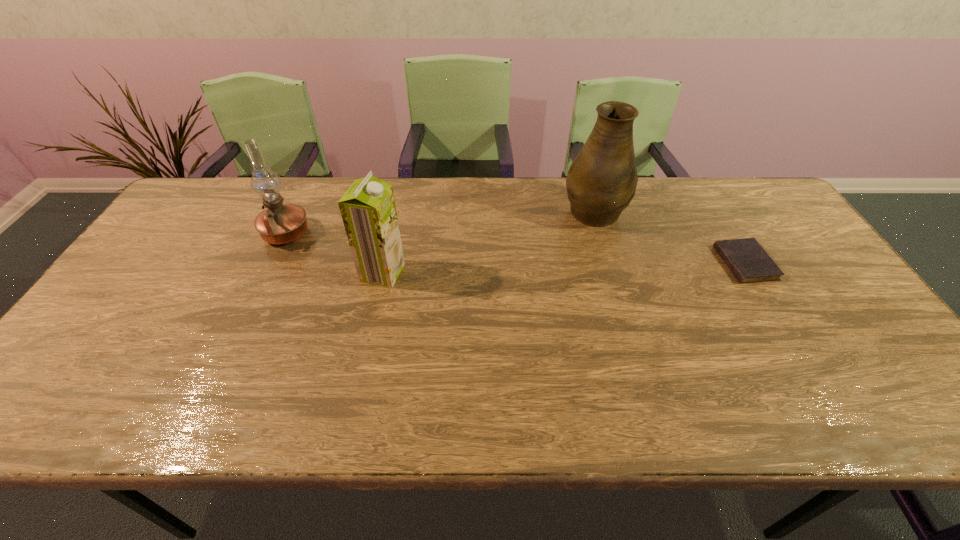
Identify the location of the second object from right to left. (601, 182).

At what (x,y) coordinates should I click in order to perform the action: click on the leftmost object. Please return your answer as a coordinate pair (x, y). Looking at the image, I should click on (279, 224).

Locate an element on the screen. The height and width of the screenshot is (540, 960). the third object from right to left is located at coordinates (368, 210).

Identify the location of the rightmost object. (748, 261).

Find the location of a particular element. The width and height of the screenshot is (960, 540). the shortest object is located at coordinates (748, 261).

Where is `vacant space situated on the handle side of the third object from left to right`? This screenshot has width=960, height=540. vacant space situated on the handle side of the third object from left to right is located at coordinates (585, 179).

At what (x,y) coordinates should I click in order to perform the action: click on free space located on the handle side of the third object from left to right. Please return your answer as a coordinate pair (x, y). This screenshot has width=960, height=540. Looking at the image, I should click on (585, 179).

This screenshot has width=960, height=540. Identify the location of free space located 0.240m on the right of the oil lamp. (391, 234).

The image size is (960, 540). Identify the location of free space located on the front of the third object from right to left. (351, 419).

Identify the location of vacant space located on the left of the rightmost object. The width and height of the screenshot is (960, 540). (682, 263).